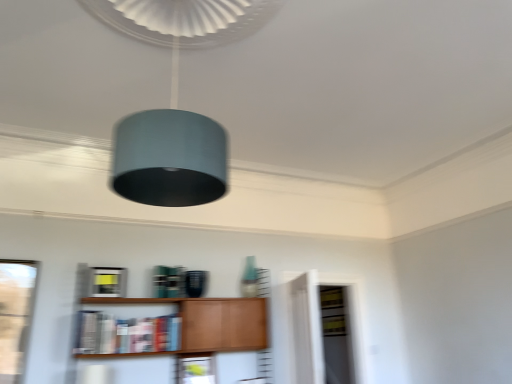
Question: From the image's perspective, is wooden shelf at lower center on transparent glass door at center?

Choices:
 (A) no
 (B) yes

Answer: (B)

Question: Is the depth of wooden shelf at lower center greater than that of transparent glass door at center?

Choices:
 (A) yes
 (B) no

Answer: (B)

Question: From a real-world perspective, is wooden shelf at lower center physically below transparent glass door at center?

Choices:
 (A) no
 (B) yes

Answer: (B)

Question: Can you confirm if wooden shelf at lower center is positioned to the left of transparent glass door at center?

Choices:
 (A) yes
 (B) no

Answer: (A)

Question: Is wooden shelf at lower center completely or partially outside of transparent glass door at center?

Choices:
 (A) no
 (B) yes

Answer: (B)

Question: Are wooden shelf at lower center and transparent glass door at center making contact?

Choices:
 (A) no
 (B) yes

Answer: (A)

Question: Does transparent glass door at center come in front of hardcover book at center?

Choices:
 (A) yes
 (B) no

Answer: (B)

Question: Is the position of transparent glass door at center more distant than that of hardcover book at center?

Choices:
 (A) no
 (B) yes

Answer: (B)

Question: Does transparent glass door at center have a smaller size compared to hardcover book at center?

Choices:
 (A) yes
 (B) no

Answer: (B)

Question: From a real-world perspective, is transparent glass door at center beneath hardcover book at center?

Choices:
 (A) no
 (B) yes

Answer: (B)

Question: From the image's perspective, is transparent glass door at center above hardcover book at center?

Choices:
 (A) yes
 (B) no

Answer: (B)

Question: Is transparent glass door at center turned away from hardcover book at center?

Choices:
 (A) no
 (B) yes

Answer: (A)

Question: Are matte wood cabinet at lower center and wooden shelf at lower center far apart?

Choices:
 (A) yes
 (B) no

Answer: (B)